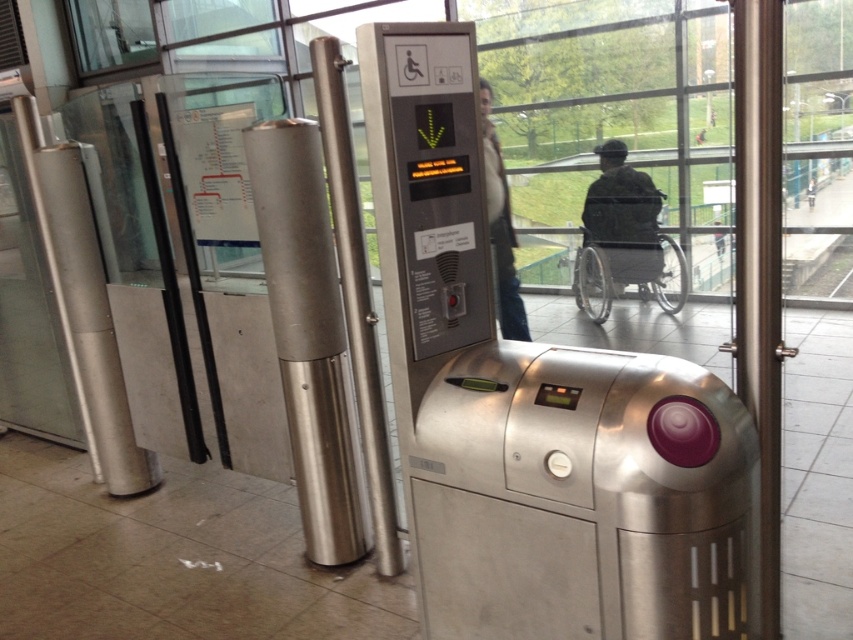
You are a person in a wheelchair trying to navigate through the turnstile area. You see the silver metallic pillar at left and the camouflage fabric wheelchair at center. Which object is taller and would require adjusting your path to avoid collision?

The silver metallic pillar at left is much taller than the camouflage fabric wheelchair at center, so you should adjust your path to avoid the silver metallic pillar at left to prevent collision.

From the picture: You are standing in front of the turnstile and need to reach the point marked at coordinate (96, 349). Can you estimate how far you need to walk to get there?

The point at coordinate (96, 349) is 3.27 meters away from your current position, so you need to walk approximately 3.27 meters to reach it.

You are a maintenance worker needing to reach the emergency button on the satin silver pole at center. There is a silver metallic pillar at left blocking your path. Can you walk straight to the pole without moving the pillar?

The silver metallic pillar at left is 1.32 meters away from the satin silver pole at center. Since the pillar is blocking the path, you would need to move around it to reach the pole, so walking straight is not possible.